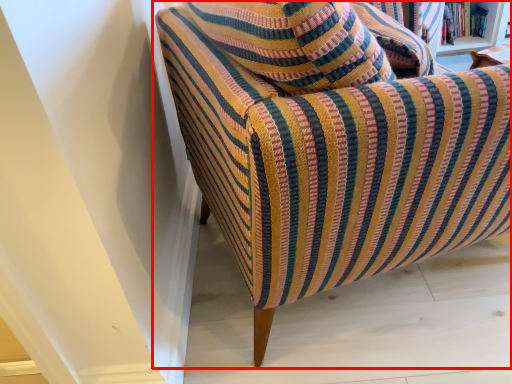
Question: Where is chair (annotated by the red box) located in relation to book in the image?

Choices:
 (A) left
 (B) right

Answer: (A)